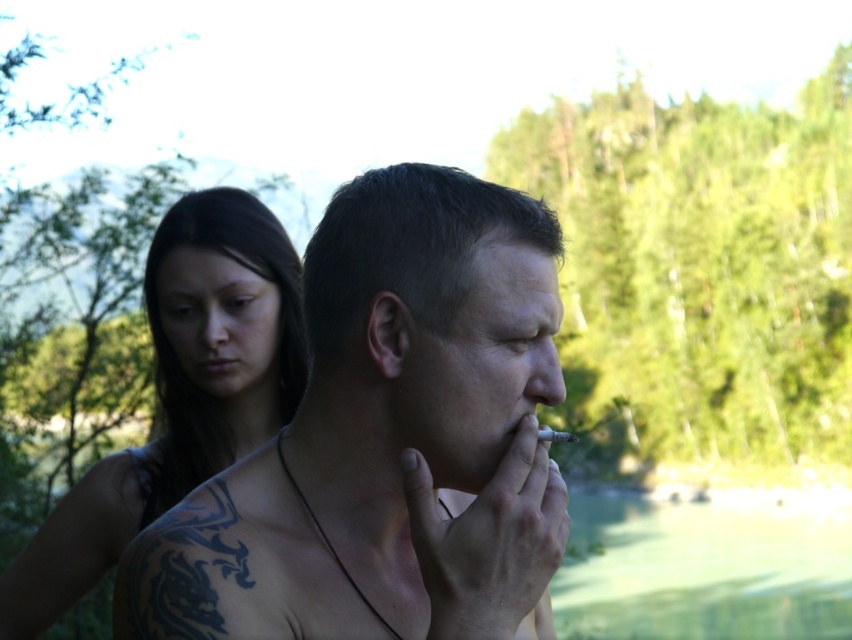
You are a photographer trying to capture the scene. You notice the black tattooed skin at upper left and the green liquid water at lower right. Which object would you focus on first if you want to ensure both are in sharp focus, considering their sizes?

The black tattooed skin at upper left is thinner than the green liquid water at lower right, so focusing on the black tattooed skin at upper left first would be better since smaller objects require a different focus point to maintain sharpness across both.

From the picture: You are a photographer trying to capture a shot of the black tattooed skin at upper left and the green liquid water at lower right in the scene. If your camera has a minimum focus distance of 2 meters, will you be able to focus on both subjects clearly without moving the camera?

The distance between the black tattooed skin at upper left and the green liquid water at lower right is 2.76 meters. Since the minimum focus distance is 2 meters, the camera can focus on both subjects clearly as the distance is greater than the minimum requirement.

You are standing at the origin of the coordinate system in this scene. There are two points marked in the image, point A at point (220, 536) and point B at point (197, 456). Which point is closer to you?

Point A at point (220, 536) is in front of point B at point (197, 456), so point A is closer to you.